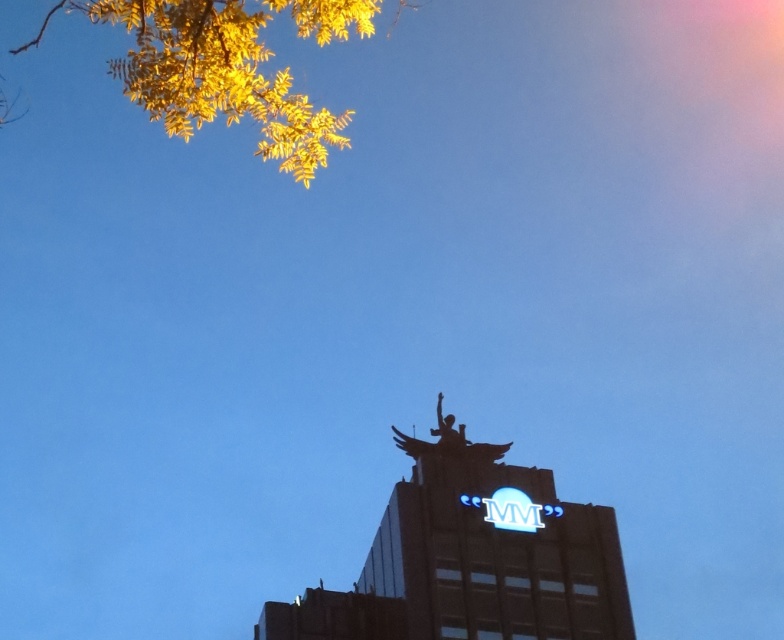
You are an architect designing a new park layout. You want to place a bench where it can be seen from both the metallic statue at center and the yellow leafy branches at upper left. Based on their sizes in the image, which object would allow for a wider viewing area for the bench placement?

The yellow leafy branches at upper left occupy more space than the metallic statue at center, so placing the bench near the yellow leafy branches at upper left would provide a wider viewing area since it covers a larger area in the scene.

You are a drone operator who needs to fly a drone from the metallic statue at center to the yellow leafy branches at upper left. The drone has a maximum flight range of 30 meters. Will it be able to reach the branches without recharging?

The metallic statue at center and yellow leafy branches at upper left are 31.62 meters apart. Since the drone can only fly up to 30 meters without recharging, it will not be able to reach the branches without needing a recharge.